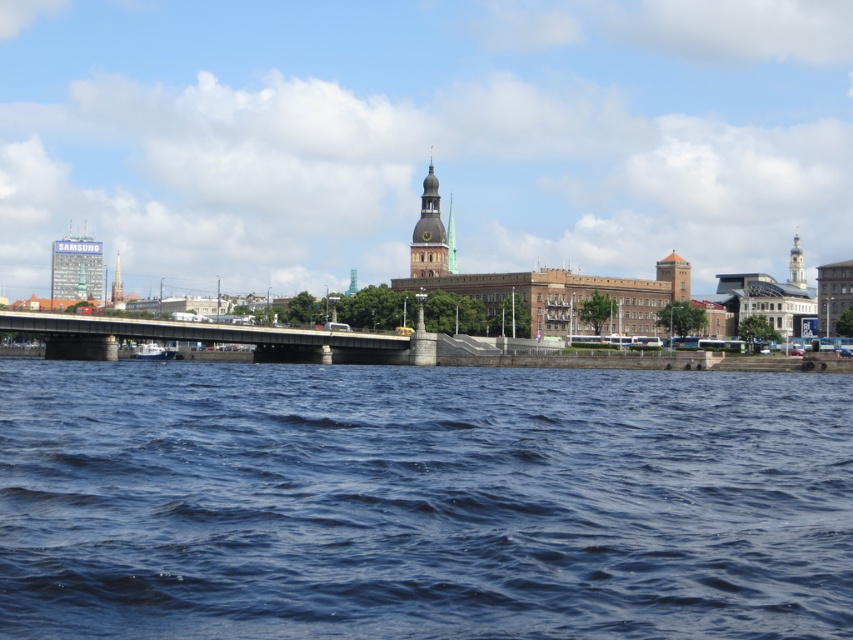
Can you confirm if blue water at lower center is positioned to the right of smooth silver tower at upper center?

No, blue water at lower center is not to the right of smooth silver tower at upper center.

Is point (122, 385) positioned behind point (793, 264)?

No, it is in front of (793, 264).

Does point (380, 426) come in front of point (799, 280)?

Yes, point (380, 426) is in front of point (799, 280).

This screenshot has width=853, height=640. I want to click on blue water at lower center, so coord(421,500).

Can you confirm if blue water at lower center is positioned above metallic bridge at center?

Incorrect, blue water at lower center is not positioned above metallic bridge at center.

Does blue water at lower center have a smaller size compared to metallic bridge at center?

No.

Identify the location of blue water at lower center. The height and width of the screenshot is (640, 853). (421, 500).

Where is `blue water at lower center`? The image size is (853, 640). blue water at lower center is located at coordinates (421, 500).

How much distance is there between blue water at lower center and brushed metal tower at left?

blue water at lower center and brushed metal tower at left are 135.74 meters apart from each other.

Describe the element at coordinates (421, 500) in the screenshot. I see `blue water at lower center` at that location.

Which is behind, point (254, 605) or point (115, 262)?

The point (115, 262) is more distant.

The height and width of the screenshot is (640, 853). Identify the location of blue water at lower center. (421, 500).